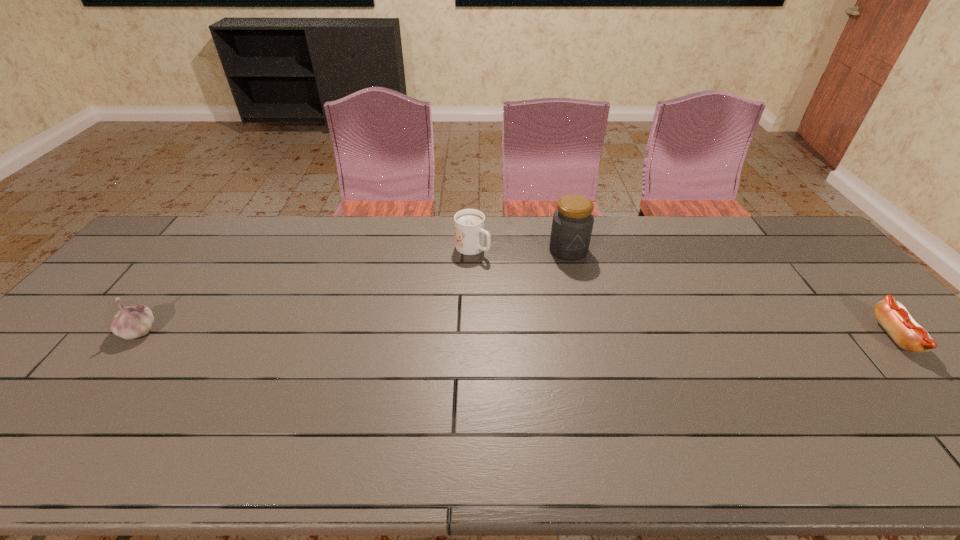
You are a GUI agent. You are given a task and a screenshot of the screen. Output one action in this format:
    pyautogui.click(x=<x>, y=<y>)
    Task: Click on the vacant spot on the desktop that is between the garlic and the rightmost object and is positioned on the surface of the jar near the warning symbol
    
    Given the screenshot: What is the action you would take?
    pyautogui.click(x=595, y=334)

Locate an element on the screen. vacant spot on the desktop that is between the leftmost object and the shortest object and is positioned on the side with the handle of the cappuccino is located at coordinates (600, 334).